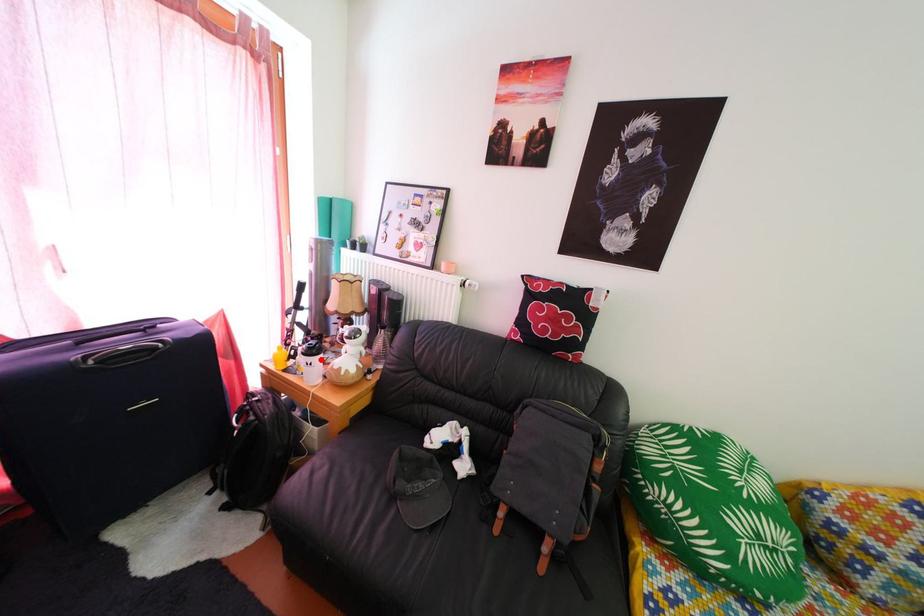
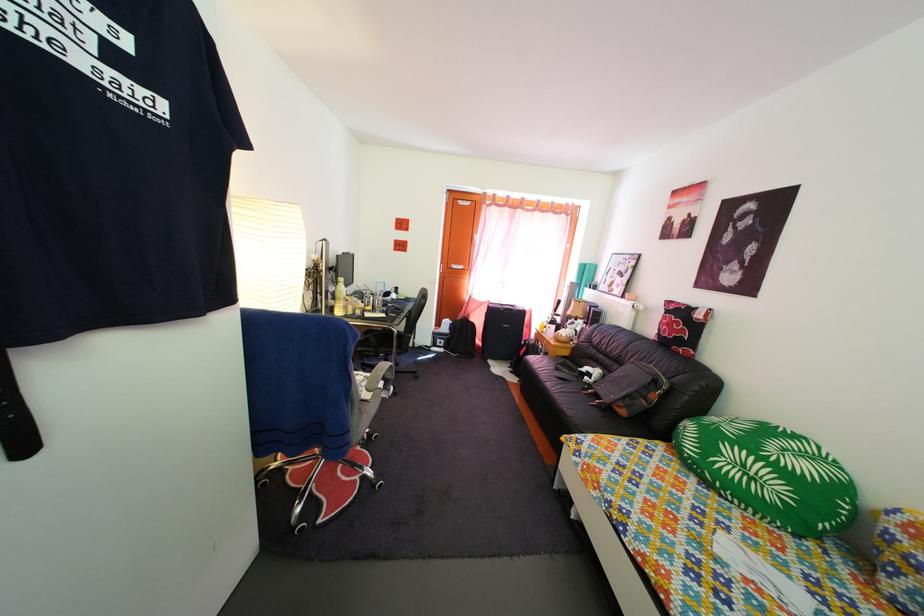
Question: I am providing you with two images of the same scene from different viewpoints. A red point is marked on the first image. Can you still see the location of the red point in image 2?

Choices:
 (A) Yes
 (B) No

Answer: (B)